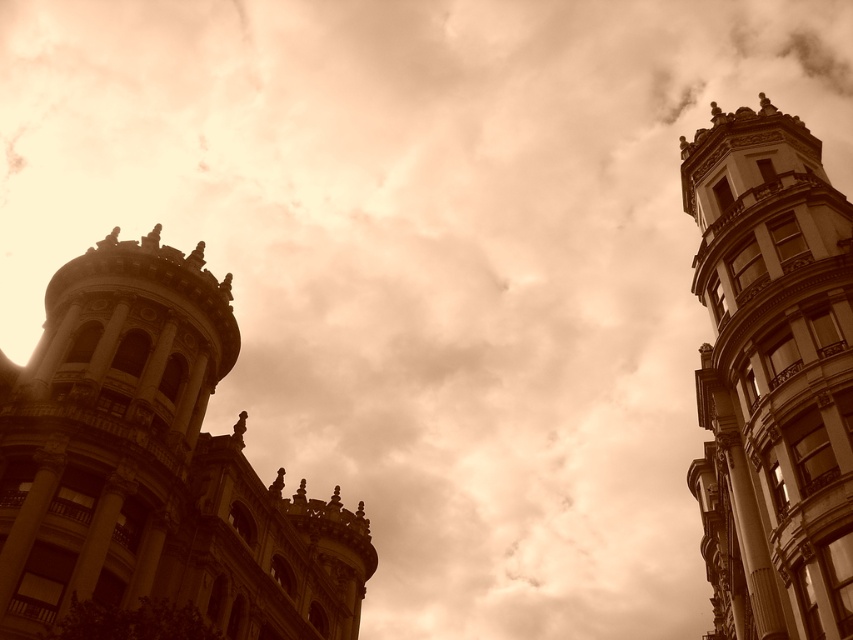
Question: Does sepia stone tower at left lie in front of smooth stone tower at right?

Choices:
 (A) yes
 (B) no

Answer: (B)

Question: Is sepia stone tower at left below smooth stone tower at right?

Choices:
 (A) no
 (B) yes

Answer: (B)

Question: Which of the following is the closest to the observer?

Choices:
 (A) (73, 280)
 (B) (782, 369)

Answer: (B)

Question: Is sepia stone tower at left bigger than smooth stone tower at right?

Choices:
 (A) no
 (B) yes

Answer: (B)